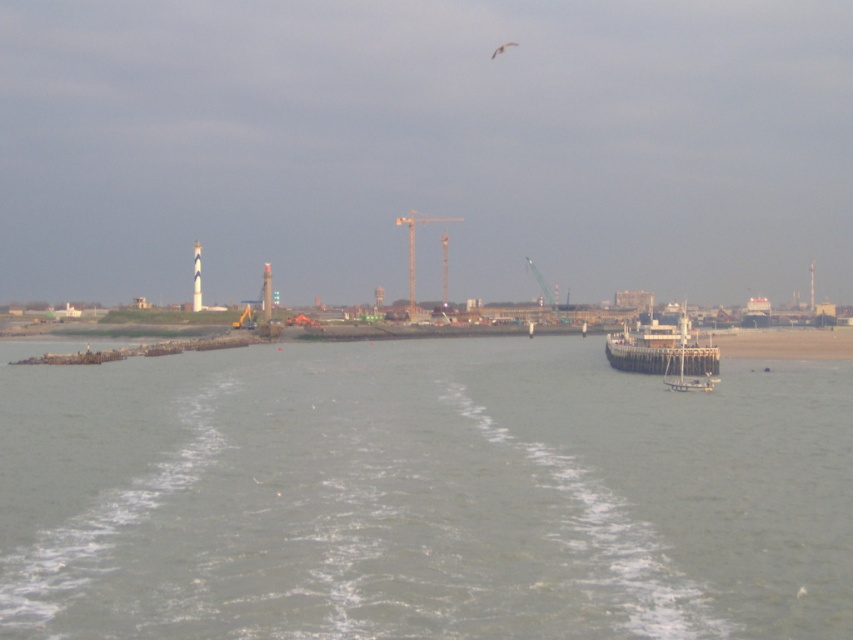
Question: Is gray water at center bigger than metallic yellow crane at center?

Choices:
 (A) no
 (B) yes

Answer: (A)

Question: Which is nearer to the metallic yellow crane at center?

Choices:
 (A) white wooden ship at center
 (B) gray water at center

Answer: (B)

Question: Which object is the farthest from the metallic yellow crane at center?

Choices:
 (A) white wooden ship at center
 (B) gray water at center

Answer: (A)

Question: Which point appears farthest from the camera in this image?

Choices:
 (A) (128, 486)
 (B) (677, 365)

Answer: (B)

Question: Does gray water at center appear under metallic yellow crane at center?

Choices:
 (A) yes
 (B) no

Answer: (A)

Question: Is white wooden ship at center wider than metallic yellow crane at center?

Choices:
 (A) yes
 (B) no

Answer: (B)